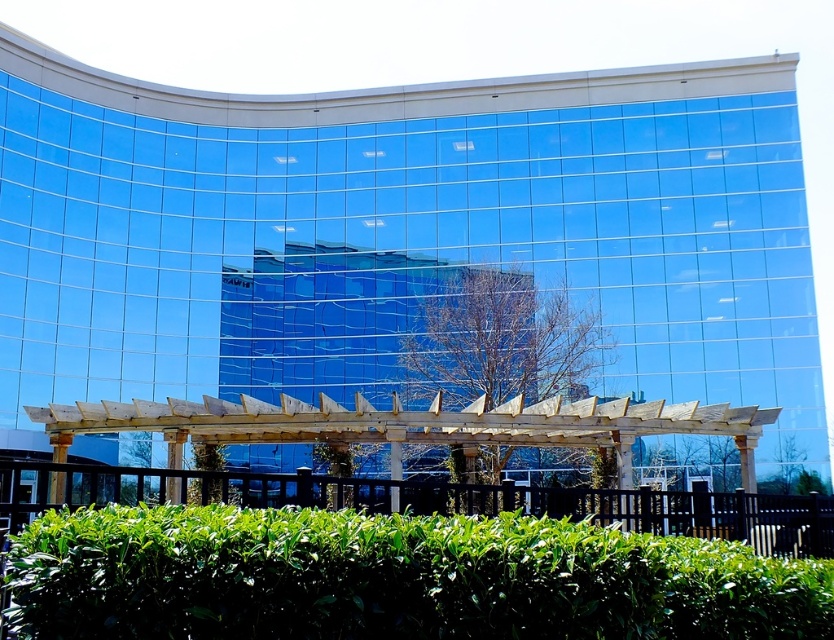
Question: Which point is farther from the camera taking this photo?

Choices:
 (A) (380, 515)
 (B) (564, 356)

Answer: (B)

Question: Is green leafy hedge at lower center smaller than green leafy bush at center?

Choices:
 (A) no
 (B) yes

Answer: (B)

Question: Does green leafy hedge at lower center have a greater width compared to green leafy bush at center?

Choices:
 (A) no
 (B) yes

Answer: (A)

Question: Is green leafy hedge at lower center positioned before green leafy bush at center?

Choices:
 (A) no
 (B) yes

Answer: (B)